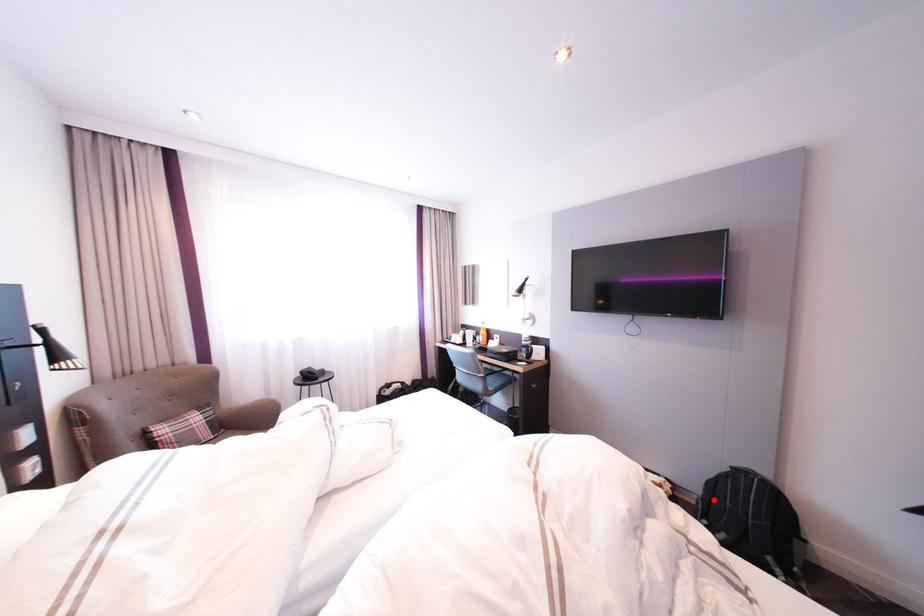
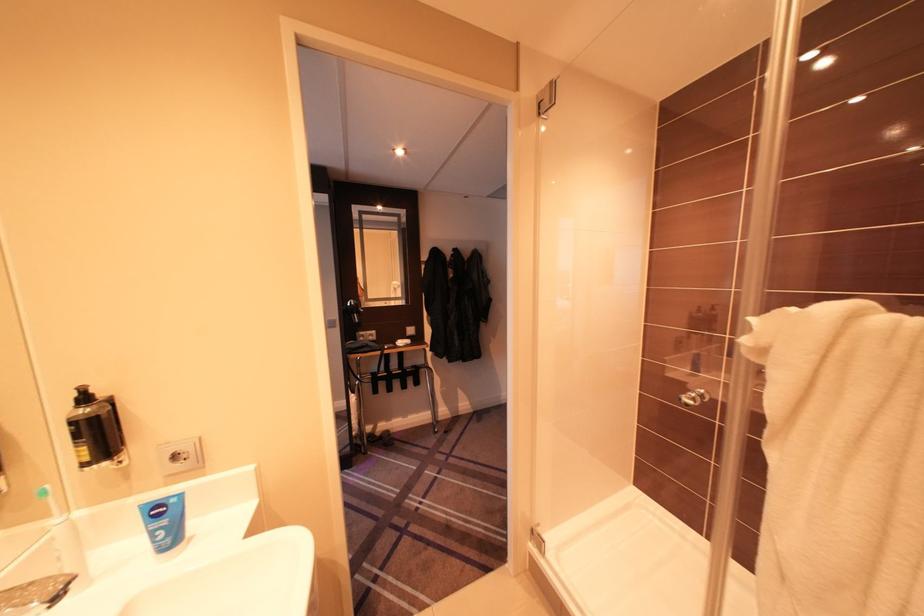
Question: I am providing you with two images of the same scene from different viewpoints. A red point is marked on the first image. Can you still see the location of the red point in image 2?

Choices:
 (A) Yes
 (B) No

Answer: (B)